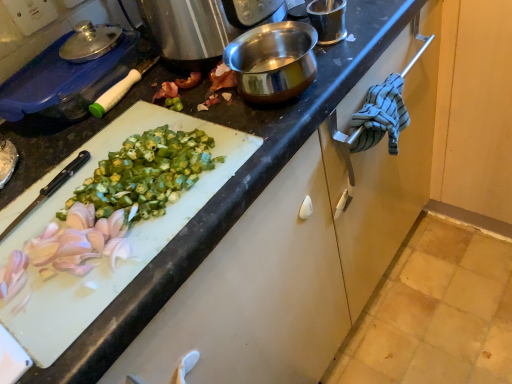
Where is `white glossy cutting board at center-left`? The image size is (512, 384). white glossy cutting board at center-left is located at coordinates (127, 239).

You are a GUI agent. You are given a task and a screenshot of the screen. Output one action in this format:
    pyautogui.click(x=<x>, y=<y>)
    Task: Click on the blue plastic container at upper left
    This screenshot has height=384, width=512.
    Given the screenshot: What is the action you would take?
    pyautogui.click(x=66, y=81)

Visually, is white glossy cutting board at center-left positioned to the left or to the right of blue plastic container at upper left?

Clearly, white glossy cutting board at center-left is on the right of blue plastic container at upper left in the image.

From a real-world perspective, which object stands above the other?

blue plastic container at upper left is physically above.

Is the position of white glossy cutting board at center-left more distant than that of blue plastic container at upper left?

No.

Find the location of a particular element. cutting board below the blue plastic container at upper left (from the image's perspective) is located at coordinates (127, 239).

The height and width of the screenshot is (384, 512). What are the coordinates of `cloth directly beneath the blue plastic container at upper left (from a real-world perspective)` in the screenshot? It's located at (380, 116).

Can you confirm if blue plastic container at upper left is positioned to the right of blue striped cloth at right?

In fact, blue plastic container at upper left is to the left of blue striped cloth at right.

In the scene shown: Is blue plastic container at upper left bigger or smaller than blue striped cloth at right?

In the image, blue plastic container at upper left appears to be larger than blue striped cloth at right.

Would you say blue plastic container at upper left contains blue striped cloth at right?

No, blue striped cloth at right is not inside blue plastic container at upper left.

Is white glossy cutting board at center-left directly adjacent to blue striped cloth at right?

white glossy cutting board at center-left and blue striped cloth at right are clearly separated.

Is white glossy cutting board at center-left inside the boundaries of blue striped cloth at right, or outside?

white glossy cutting board at center-left is not enclosed by blue striped cloth at right.

Does white glossy cutting board at center-left have a greater height compared to blue striped cloth at right?

Incorrect, the height of white glossy cutting board at center-left is not larger of that of blue striped cloth at right.

Which is nearer, (143, 233) or (368, 118)?

Clearly, point (143, 233) is closer to the camera than point (368, 118).

Based on the photo, is blue plastic container at upper left wider or thinner than white glossy cutting board at center-left?

In the image, blue plastic container at upper left appears to be more narrow than white glossy cutting board at center-left.

Is blue plastic container at upper left surrounding white glossy cutting board at center-left?

That's incorrect, white glossy cutting board at center-left is not inside blue plastic container at upper left.

Can you tell me how much blue plastic container at upper left and white glossy cutting board at center-left differ in facing direction?

blue plastic container at upper left and white glossy cutting board at center-left are facing 1.14 degrees away from each other.

Is blue plastic container at upper left looking in the opposite direction of white glossy cutting board at center-left?

No.

Between blue striped cloth at right and blue plastic container at upper left, which one appears on the left side from the viewer's perspective?

blue plastic container at upper left is more to the left.

Does blue striped cloth at right have a lesser width compared to blue plastic container at upper left?

Yes.

Which object is more forward, blue striped cloth at right or blue plastic container at upper left?

blue plastic container at upper left is closer to the camera.

From the picture: From the image's perspective, is blue striped cloth at right positioned above or below blue plastic container at upper left?

Clearly, from the image's perspective, blue striped cloth at right is below blue plastic container at upper left.

Is blue striped cloth at right inside the boundaries of white glossy cutting board at center-left, or outside?

blue striped cloth at right is located beyond the bounds of white glossy cutting board at center-left.

Consider the image. Which is in front, blue striped cloth at right or white glossy cutting board at center-left?

white glossy cutting board at center-left.

Does blue striped cloth at right have a greater height compared to white glossy cutting board at center-left?

Yes, blue striped cloth at right is taller than white glossy cutting board at center-left.

In terms of width, does blue striped cloth at right look wider or thinner when compared to white glossy cutting board at center-left?

Considering their sizes, blue striped cloth at right looks slimmer than white glossy cutting board at center-left.

This screenshot has width=512, height=384. Identify the location of kitchen appliance that is above the white glossy cutting board at center-left (from a real-world perspective). (66, 81).

This screenshot has width=512, height=384. What are the coordinates of `cloth behind the blue plastic container at upper left` in the screenshot? It's located at (380, 116).

From the image, which object appears to be nearer to blue plastic container at upper left, white glossy cutting board at center-left or blue striped cloth at right?

Based on the image, white glossy cutting board at center-left appears to be nearer to blue plastic container at upper left.

Looking at the image, which one is located further to blue striped cloth at right, white glossy cutting board at center-left or blue plastic container at upper left?

blue plastic container at upper left is positioned further to the anchor blue striped cloth at right.

Which object lies further to the anchor point blue striped cloth at right, blue plastic container at upper left or white glossy cutting board at center-left?

blue plastic container at upper left lies further to blue striped cloth at right than the other object.

Estimate the real-world distances between objects in this image. Which object is further from white glossy cutting board at center-left, blue plastic container at upper left or blue striped cloth at right?

The object further to white glossy cutting board at center-left is blue striped cloth at right.

Based on their spatial positions, is blue striped cloth at right or white glossy cutting board at center-left further from blue plastic container at upper left?

blue striped cloth at right.

From the picture: Looking at the image, which one is located closer to white glossy cutting board at center-left, blue striped cloth at right or blue plastic container at upper left?

Among the two, blue plastic container at upper left is located nearer to white glossy cutting board at center-left.

The height and width of the screenshot is (384, 512). What are the coordinates of `cutting board between blue plastic container at upper left and blue striped cloth at right` in the screenshot? It's located at (127, 239).